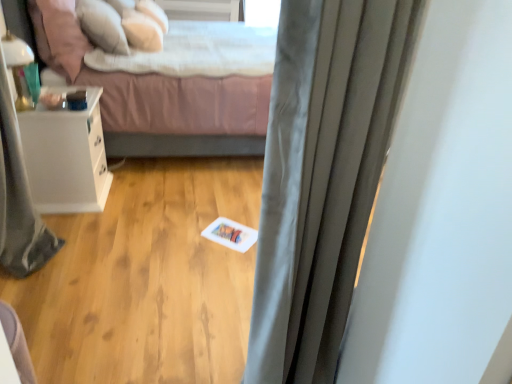
Locate an element on the screen. soft white pillow at upper center, arranged as the 3th pillow when viewed from the front is located at coordinates (153, 13).

What do you see at coordinates (153, 13) in the screenshot? This screenshot has height=384, width=512. I see `soft white pillow at upper center, arranged as the 3th pillow when viewed from the front` at bounding box center [153, 13].

Measure the distance between soft pink pillow at upper left, the 3th pillow when ordered from back to front, and camera.

soft pink pillow at upper left, the 3th pillow when ordered from back to front, and camera are 8.16 feet apart from each other.

This screenshot has height=384, width=512. I want to click on white matte card at center, so click(231, 234).

Locate an element on the screen. soft pink fabric bed at center is located at coordinates (164, 103).

Measure the distance between satin gray curtain at center and camera.

satin gray curtain at center is 26.87 inches away from camera.

What do you see at coordinates (102, 26) in the screenshot? The image size is (512, 384). I see `white soft pillow at upper left, the second pillow in the front-to-back sequence` at bounding box center [102, 26].

At what (x,y) coordinates should I click in order to perform the action: click on white glossy nightstand at left. Please return your answer as a coordinate pair (x, y). Looking at the image, I should click on (66, 155).

Is gray fabric shower curtain at left smaller than soft pink fabric bed at center?

Indeed, gray fabric shower curtain at left has a smaller size compared to soft pink fabric bed at center.

Which is further, (x=39, y=226) or (x=112, y=138)?

The point (x=112, y=138) is behind.

Is gray fabric shower curtain at left located outside soft pink fabric bed at center?

Yes.

From the image's perspective, is gray fabric shower curtain at left on soft pink fabric bed at center?

Actually, gray fabric shower curtain at left appears below soft pink fabric bed at center in the image.

Can you confirm if satin gray curtain at center is shorter than white glossy nightstand at left?

Incorrect, the height of satin gray curtain at center does not fall short of that of white glossy nightstand at left.

From the image's perspective, is satin gray curtain at center above white glossy nightstand at left?

Actually, satin gray curtain at center appears below white glossy nightstand at left in the image.

Looking at this image, do you think satin gray curtain at center is within white glossy nightstand at left, or outside of it?

satin gray curtain at center lies outside white glossy nightstand at left.

Could you tell me if soft white pillow at upper center, marked as the 1th pillow in a back-to-front arrangement, is facing satin gray curtain at center?

No, soft white pillow at upper center, marked as the 1th pillow in a back-to-front arrangement, does not turn towards satin gray curtain at center.

Looking at this image, does soft white pillow at upper center, marked as the 1th pillow in a back-to-front arrangement, have a smaller size compared to satin gray curtain at center?

Correct, soft white pillow at upper center, marked as the 1th pillow in a back-to-front arrangement, occupies less space than satin gray curtain at center.

What are the coordinates of `curtain in front of the soft white pillow at upper center, arranged as the 3th pillow when viewed from the front` in the screenshot? It's located at (322, 175).

Is soft white pillow at upper center, marked as the 1th pillow in a back-to-front arrangement, taller or shorter than satin gray curtain at center?

Considering their sizes, soft white pillow at upper center, marked as the 1th pillow in a back-to-front arrangement, has less height than satin gray curtain at center.

Based on the photo, who is smaller, white soft pillow at upper left, the second pillow positioned from the back, or white matte card at center?

white matte card at center.

From the image's perspective, relative to white matte card at center, is white soft pillow at upper left, the second pillow positioned from the back, above or below?

From the image's perspective, white soft pillow at upper left, the second pillow positioned from the back, appears above white matte card at center.

Based on the photo, can you tell me how much white soft pillow at upper left, the second pillow positioned from the back, and white matte card at center differ in facing direction?

53.2 degrees.

From a real-world perspective, which object rests below the other?

From a 3D spatial view, white matte card at center is below.

Considering the positions of objects soft pink pillow at upper left, the 3th pillow when ordered from back to front, and white matte card at center in the image provided, who is in front, soft pink pillow at upper left, the 3th pillow when ordered from back to front, or white matte card at center?

white matte card at center.

Considering the relative sizes of soft pink pillow at upper left, the 3th pillow when ordered from back to front, and white matte card at center in the image provided, is soft pink pillow at upper left, the 3th pillow when ordered from back to front, shorter than white matte card at center?

Incorrect, the height of soft pink pillow at upper left, the 3th pillow when ordered from back to front, does not fall short of that of white matte card at center.

From the image's perspective, between soft pink pillow at upper left, the 3th pillow when ordered from back to front, and white matte card at center, who is located below?

white matte card at center is shown below in the image.

Is soft white pillow at upper center, arranged as the 3th pillow when viewed from the front, directly adjacent to white matte card at center?

No, soft white pillow at upper center, arranged as the 3th pillow when viewed from the front, is not next to white matte card at center.

How many degrees apart are the facing directions of soft white pillow at upper center, arranged as the 3th pillow when viewed from the front, and white matte card at center?

The angular difference between soft white pillow at upper center, arranged as the 3th pillow when viewed from the front, and white matte card at center is 40.6 degrees.

Which object is wider, soft white pillow at upper center, arranged as the 3th pillow when viewed from the front, or white matte card at center?

Wider between the two is white matte card at center.

Between satin gray curtain at center and white soft pillow at upper left, the second pillow in the front-to-back sequence, which one has larger width?

With larger width is white soft pillow at upper left, the second pillow in the front-to-back sequence.

Which of these two, satin gray curtain at center or white soft pillow at upper left, the second pillow in the front-to-back sequence, is bigger?

satin gray curtain at center is bigger.

From a real-world perspective, is satin gray curtain at center physically above white soft pillow at upper left, the second pillow in the front-to-back sequence?

Incorrect, from a real-world perspective, satin gray curtain at center is lower than white soft pillow at upper left, the second pillow in the front-to-back sequence.

Which object is closer to the camera taking this photo, satin gray curtain at center or white soft pillow at upper left, the second pillow in the front-to-back sequence?

satin gray curtain at center is in front.

I want to click on shower curtain in front of the soft pink fabric bed at center, so click(18, 199).

Where is `curtain above the white glossy nightstand at left (from a real-world perspective)`? curtain above the white glossy nightstand at left (from a real-world perspective) is located at coordinates (322, 175).

Which object lies further to the anchor point white glossy nightstand at left, white soft pillow at upper left, the second pillow positioned from the back, or white matte card at center?

The object further to white glossy nightstand at left is white matte card at center.

Looking at the image, which one is located closer to satin gray curtain at center, gray fabric shower curtain at left or white soft pillow at upper left, the second pillow positioned from the back?

gray fabric shower curtain at left is positioned closer to the anchor satin gray curtain at center.

Estimate the real-world distances between objects in this image. Which object is closer to soft pink fabric bed at center, satin gray curtain at center or white soft pillow at upper left, the second pillow positioned from the back?

Among the two, white soft pillow at upper left, the second pillow positioned from the back, is located nearer to soft pink fabric bed at center.

Estimate the real-world distances between objects in this image. Which object is closer to white matte card at center, satin gray curtain at center or soft pink pillow at upper left, acting as the 1th pillow starting from the front?

Among the two, satin gray curtain at center is located nearer to white matte card at center.

Estimate the real-world distances between objects in this image. Which object is further from white soft pillow at upper left, the second pillow positioned from the back, soft pink pillow at upper left, the 3th pillow when ordered from back to front, or white glossy nightstand at left?

Based on the image, white glossy nightstand at left appears to be further to white soft pillow at upper left, the second pillow positioned from the back.

Which object lies nearer to the anchor point gray fabric shower curtain at left, soft white pillow at upper center, arranged as the 3th pillow when viewed from the front, or satin gray curtain at center?

satin gray curtain at center is positioned closer to the anchor gray fabric shower curtain at left.

Looking at the image, which one is located closer to gray fabric shower curtain at left, white glossy nightstand at left or white matte card at center?

white glossy nightstand at left lies closer to gray fabric shower curtain at left than the other object.

Estimate the real-world distances between objects in this image. Which object is further from gray fabric shower curtain at left, white soft pillow at upper left, the second pillow positioned from the back, or soft pink pillow at upper left, the 3th pillow when ordered from back to front?

The object further to gray fabric shower curtain at left is white soft pillow at upper left, the second pillow positioned from the back.

Where is `shower curtain between satin gray curtain at center and soft pink fabric bed at center from front to back`? The width and height of the screenshot is (512, 384). shower curtain between satin gray curtain at center and soft pink fabric bed at center from front to back is located at coordinates 18,199.

Where is `card between satin gray curtain at center and soft pink fabric bed at center along the z-axis`? card between satin gray curtain at center and soft pink fabric bed at center along the z-axis is located at coordinates (231, 234).

Locate an element on the screen. The width and height of the screenshot is (512, 384). shower curtain between soft pink fabric bed at center and white matte card at center from top to bottom is located at coordinates (18, 199).

This screenshot has height=384, width=512. I want to click on bed between white glossy nightstand at left and soft white pillow at upper center, arranged as the 3th pillow when viewed from the front, from front to back, so (x=164, y=103).